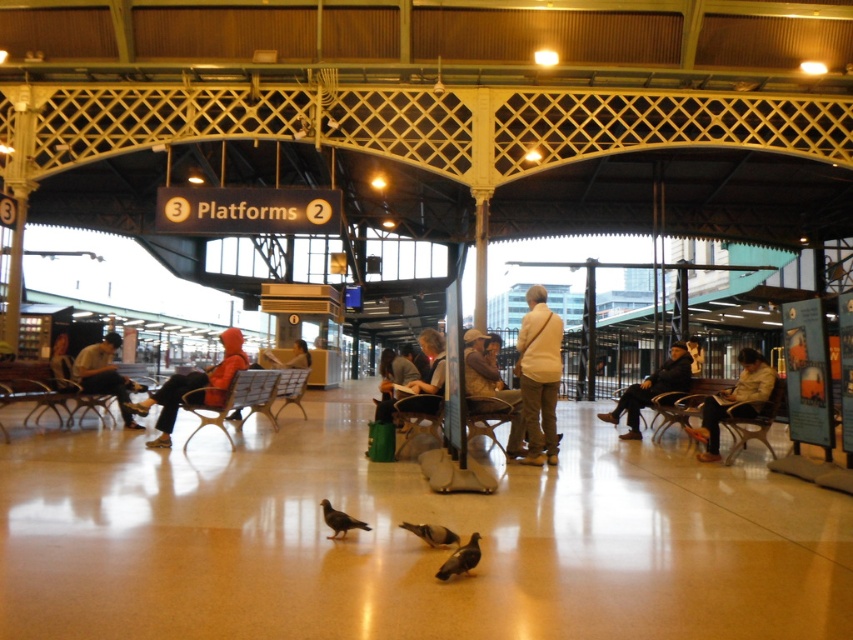
Which is more to the right, dark gray fabric jacket at center or brown matte pigeon at center?

dark gray fabric jacket at center is more to the right.

Between point (642, 381) and point (335, 512), which one is positioned in front?

Point (335, 512) is more forward.

The width and height of the screenshot is (853, 640). I want to click on dark gray fabric jacket at center, so click(x=653, y=388).

Which is more to the right, matte black jacket at left or brown matte pigeon at center?

Positioned to the right is brown matte pigeon at center.

Measure the distance between matte black jacket at left and camera.

33.71 feet

Identify the location of matte black jacket at left. This screenshot has height=640, width=853. (105, 376).

Is dark gray fabric jacket at center thinner than gray matte pigeon at lower center?

No, dark gray fabric jacket at center is not thinner than gray matte pigeon at lower center.

Which of these two, dark gray fabric jacket at center or gray matte pigeon at lower center, stands shorter?

gray matte pigeon at lower center is shorter.

Find the location of a particular element. The height and width of the screenshot is (640, 853). dark gray fabric jacket at center is located at coordinates (653, 388).

This screenshot has width=853, height=640. What are the coordinates of `dark gray fabric jacket at center` in the screenshot? It's located at (653, 388).